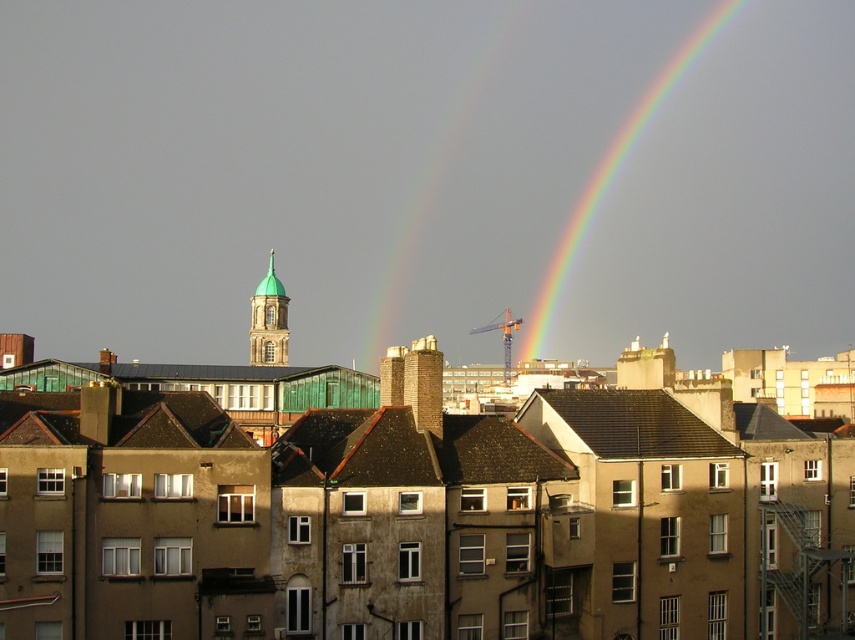
You are a city planner assessing the visibility of the green copper dome at center from the rainbow at upper center. Given that the rainbow is 102.02 meters away, would the dome be clearly visible from the rainbow? Consider typical city obstacles like other buildings or trees.

The green copper dome at center is 102.02 meters away from the rainbow at upper center. Since the dome is a tall and distinctive structure, it would likely be visible from the rainbow unless there are significant obstacles like other tall buildings or dense tree cover between them. The scene description mentions residential buildings in the foreground but does not specify any obstructions, so the dome should be clearly visible.

You are an architect analyzing the cityscape. You need to determine the vertical relationship between the brick chimney at center and the green copper dome at center. Which one is positioned lower in the scene?

The brick chimney at center is positioned below the green copper dome at center, so the brick chimney at center is lower in the scene.

What is the 2D coordinate of the rainbow at upper center in the cityscape image?

The rainbow at upper center is located at the 2D coordinate point of [612,177].